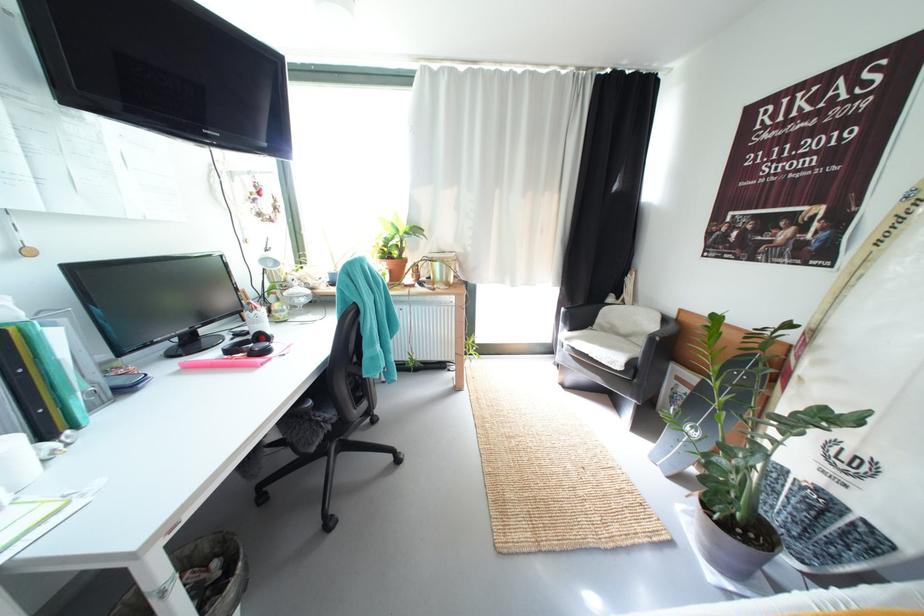
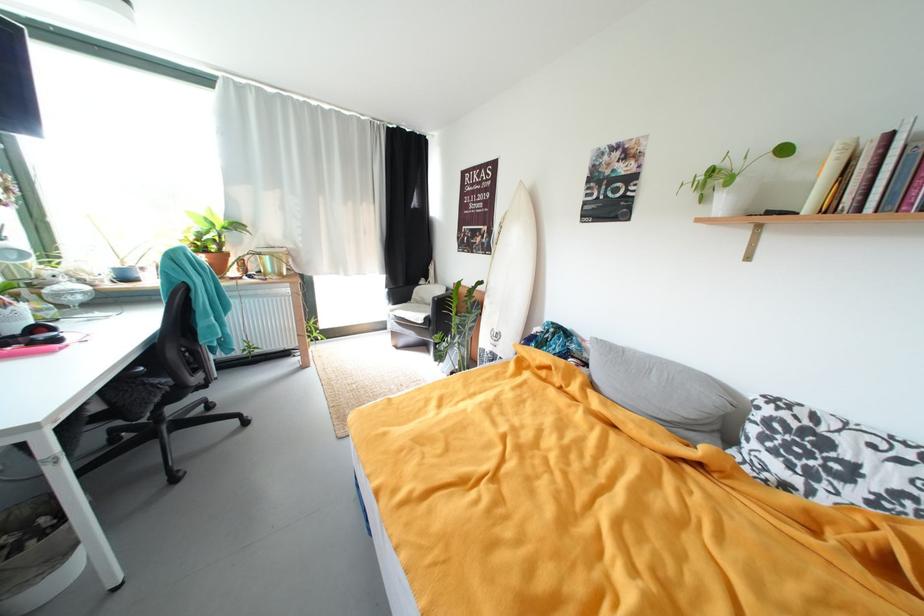
Where in the second image is the point corresponding to (x=576, y=341) from the first image?

(399, 313)